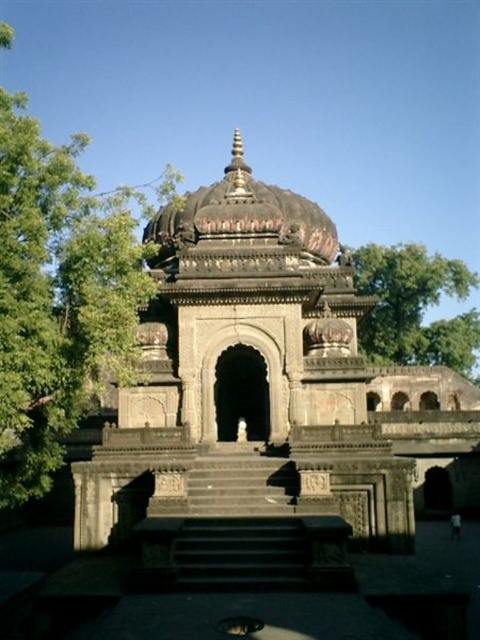
You are standing in front of the temple and want to take a photo that includes both the green leafy tree at left and the green leafy tree at upper right. Which tree should you position closer to the camera to ensure both are in the frame?

You should position the green leafy tree at left closer to the camera because it is already closer to the viewer than the green leafy tree at upper right, ensuring both are visible in the frame.

Looking at this image, you are standing in front of the temple and notice a point marked at coordinates (59, 296). Based on the scene description, what object does this coordinate correspond to?

The point at coordinates (59, 296) corresponds to the green leafy tree at left.